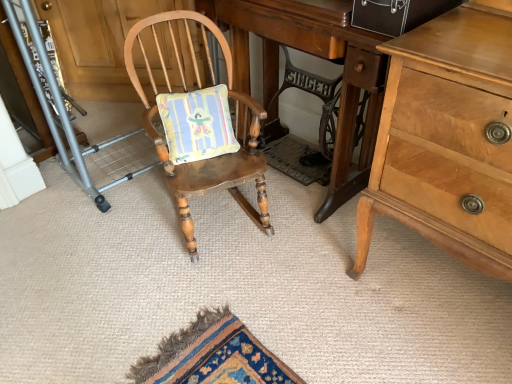
Describe the element at coordinates (317, 56) in the screenshot. Image resolution: width=512 pixels, height=384 pixels. I see `wooden desk at center` at that location.

In order to face brushed metal folding chair at left, should I rotate leftwards or rightwards?

You should rotate left by 29.336 degrees.

Where is `brushed metal folding chair at left`? The image size is (512, 384). brushed metal folding chair at left is located at coordinates (21, 92).

You are a GUI agent. You are given a task and a screenshot of the screen. Output one action in this format:
    pyautogui.click(x=<x>, y=<y>)
    Task: Click on the wooden desk at center
    The image size is (512, 384).
    Given the screenshot: What is the action you would take?
    pyautogui.click(x=317, y=56)

Is wooden desk at center facing away from wooden rocking chair at center?

Yes, wooden rocking chair at center is at the back of wooden desk at center.

What's the angular difference between wooden desk at center and wooden rocking chair at center's facing directions?

wooden desk at center and wooden rocking chair at center are facing 68.8 degrees away from each other.

Based on their positions, is wooden desk at center located to the left or right of wooden rocking chair at center?

wooden desk at center is positioned on wooden rocking chair at center's right side.

Is wooden desk at center positioned beyond the bounds of wooden rocking chair at center?

wooden desk at center lies outside wooden rocking chair at center's area.

Considering the sizes of objects light brown wooden chest of drawers at right and wooden rocking chair at center in the image provided, who is shorter, light brown wooden chest of drawers at right or wooden rocking chair at center?

wooden rocking chair at center.

Identify the location of the chest of drawers in front of the wooden rocking chair at center. This screenshot has height=384, width=512. (448, 138).

Between light brown wooden chest of drawers at right and wooden rocking chair at center, which one has smaller size?

wooden rocking chair at center is smaller.

Is point (484, 173) positioned after point (266, 197)?

No.

Between wooden rocking chair at center and wooden desk at center, which one has less height?

wooden rocking chair at center is shorter.

Can we say wooden rocking chair at center lies outside wooden desk at center?

Yes, wooden rocking chair at center is located beyond the bounds of wooden desk at center.

Is wooden rocking chair at center in front of wooden desk at center?

Yes, it is in front of wooden desk at center.

Locate an element on the screen. This screenshot has width=512, height=384. chest of drawers above the wooden desk at center (from a real-world perspective) is located at coordinates (448, 138).

Is wooden desk at center oriented away from light brown wooden chest of drawers at right?

No.

How different are the orientations of wooden desk at center and light brown wooden chest of drawers at right in degrees?

wooden desk at center and light brown wooden chest of drawers at right are facing 6.16e-06 degrees away from each other.

Is wooden desk at center not close to light brown wooden chest of drawers at right?

They are positioned close to each other.

Between brushed metal folding chair at left and wooden rocking chair at center, which one has larger size?

wooden rocking chair at center is bigger.

From the image's perspective, between brushed metal folding chair at left and wooden rocking chair at center, who is located below?

From the image's view, wooden rocking chair at center is below.

Which is closer to the camera, (12, 71) or (148, 19)?

The point (148, 19) is more forward.

Consider the image. Is brushed metal folding chair at left shorter than wooden rocking chair at center?

Yes, brushed metal folding chair at left is shorter than wooden rocking chair at center.

Which object is thinner, wooden rocking chair at center or brushed metal folding chair at left?

brushed metal folding chair at left is thinner.

From a real-world perspective, which is physically below, wooden rocking chair at center or brushed metal folding chair at left?

In real-world perspective, wooden rocking chair at center is lower.

Consider the image. Is wooden rocking chair at center located outside brushed metal folding chair at left?

Indeed, wooden rocking chair at center is completely outside brushed metal folding chair at left.

From the image's perspective, is wooden rocking chair at center on top of brushed metal folding chair at left?

No, from the image's perspective, wooden rocking chair at center is not above brushed metal folding chair at left.

Is brushed metal folding chair at left turned away from wooden desk at center?

brushed metal folding chair at left is not turned away from wooden desk at center.

Who is smaller, brushed metal folding chair at left or wooden desk at center?

With smaller size is brushed metal folding chair at left.

Is wooden desk at center a part of brushed metal folding chair at left?

That's incorrect, wooden desk at center is not inside brushed metal folding chair at left.

How many degrees apart are the facing directions of brushed metal folding chair at left and wooden desk at center?

179 degrees separate the facing orientations of brushed metal folding chair at left and wooden desk at center.

Image resolution: width=512 pixels, height=384 pixels. Identify the location of chair in front of the wooden desk at center. (200, 86).

Locate an element on the screen. This screenshot has height=384, width=512. chair behind the light brown wooden chest of drawers at right is located at coordinates (200, 86).

Based on their spatial positions, is wooden rocking chair at center or brushed metal folding chair at left further from wooden desk at center?

Based on the image, brushed metal folding chair at left appears to be further to wooden desk at center.

Considering their positions, is wooden desk at center positioned further to brushed metal folding chair at left than wooden rocking chair at center?

Based on the image, wooden desk at center appears to be further to brushed metal folding chair at left.

When comparing their distances from brushed metal folding chair at left, does light brown wooden chest of drawers at right or wooden desk at center seem further?

light brown wooden chest of drawers at right.

Which object lies further to the anchor point brushed metal folding chair at left, wooden rocking chair at center or light brown wooden chest of drawers at right?

light brown wooden chest of drawers at right.

Looking at the image, which one is located closer to light brown wooden chest of drawers at right, wooden desk at center or brushed metal folding chair at left?

wooden desk at center is positioned closer to the anchor light brown wooden chest of drawers at right.

Which object lies further to the anchor point wooden desk at center, light brown wooden chest of drawers at right or brushed metal folding chair at left?

Among the two, brushed metal folding chair at left is located further to wooden desk at center.

From the image, which object appears to be farther from light brown wooden chest of drawers at right, brushed metal folding chair at left or wooden rocking chair at center?

Based on the image, brushed metal folding chair at left appears to be further to light brown wooden chest of drawers at right.

Looking at the image, which one is located closer to wooden desk at center, brushed metal folding chair at left or wooden rocking chair at center?

Based on the image, wooden rocking chair at center appears to be nearer to wooden desk at center.

Locate an element on the screen. This screenshot has width=512, height=384. desk between brushed metal folding chair at left and light brown wooden chest of drawers at right from left to right is located at coordinates pos(317,56).

Find the location of `desk between wooden rocking chair at center and light brown wooden chest of drawers at right`. desk between wooden rocking chair at center and light brown wooden chest of drawers at right is located at coordinates (317, 56).

Find the location of a particular element. Image resolution: width=512 pixels, height=384 pixels. chair between brushed metal folding chair at left and wooden desk at center is located at coordinates (200, 86).

I want to click on chair between brushed metal folding chair at left and light brown wooden chest of drawers at right in the horizontal direction, so [x=200, y=86].